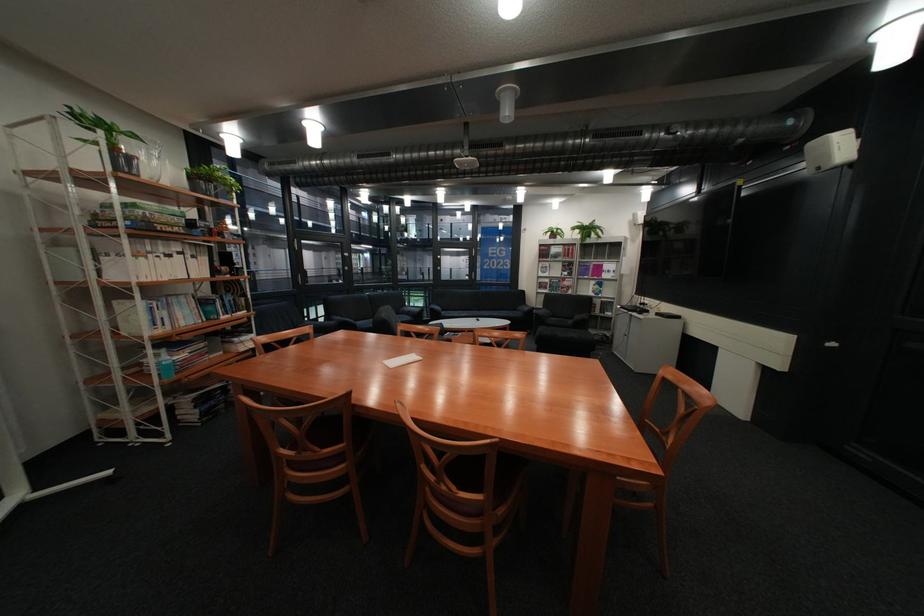
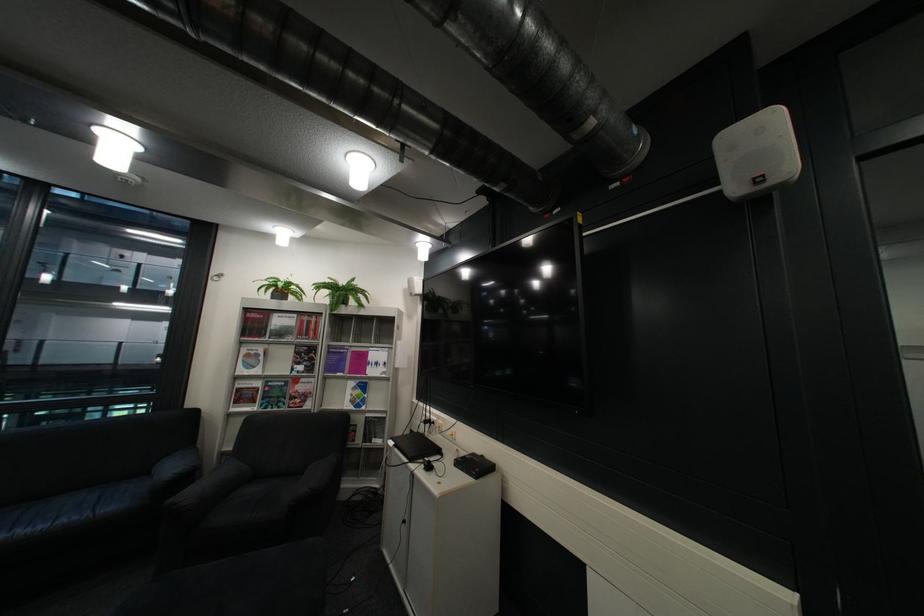
Where in the second image is the point corresponding to the point at 565,233 from the first image?

(287, 290)